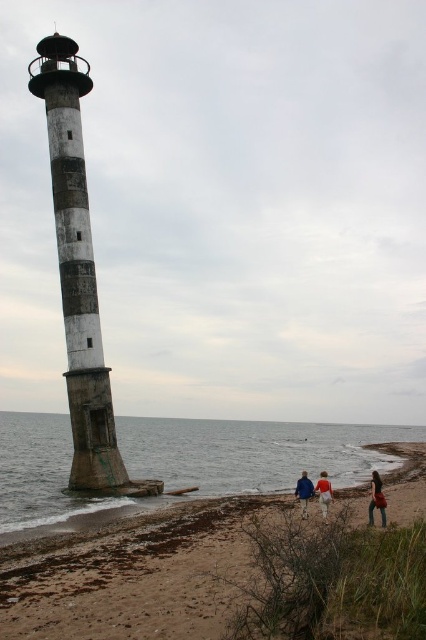
Question: Which point is closer to the camera?

Choices:
 (A) (45, 593)
 (B) (328, 506)
 (C) (66, 88)

Answer: (A)

Question: Estimate the real-world distances between objects in this image. Which object is farther from the clear water at lower left?

Choices:
 (A) denim jacket at lower right
 (B) concrete lighthouse at left
 (C) blue fabric jacket at lower center
 (D) tan fabric jacket at lower center

Answer: (C)

Question: Does denim jacket at lower right have a smaller size compared to blue fabric jacket at lower center?

Choices:
 (A) yes
 (B) no

Answer: (B)

Question: Is concrete lighthouse at left below blue fabric jacket at lower center?

Choices:
 (A) no
 (B) yes

Answer: (A)

Question: Does clear water at lower left come in front of concrete lighthouse at left?

Choices:
 (A) no
 (B) yes

Answer: (B)

Question: Which object is positioned closest to the tan fabric jacket at lower center?

Choices:
 (A) blue fabric jacket at lower center
 (B) brown sand at lower right
 (C) denim pants at lower center
 (D) concrete lighthouse at left

Answer: (A)